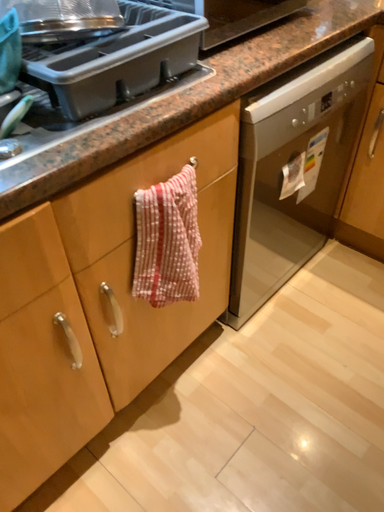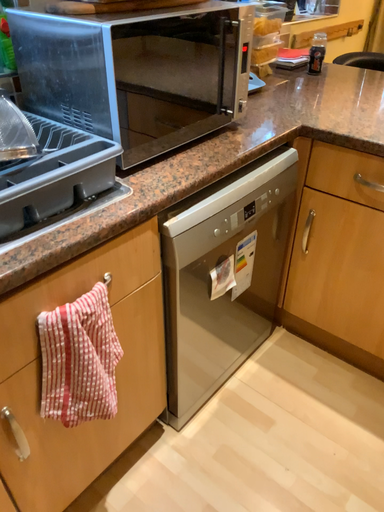
Question: How did the camera likely rotate when shooting the video?

Choices:
 (A) rotated upward
 (B) rotated downward

Answer: (A)